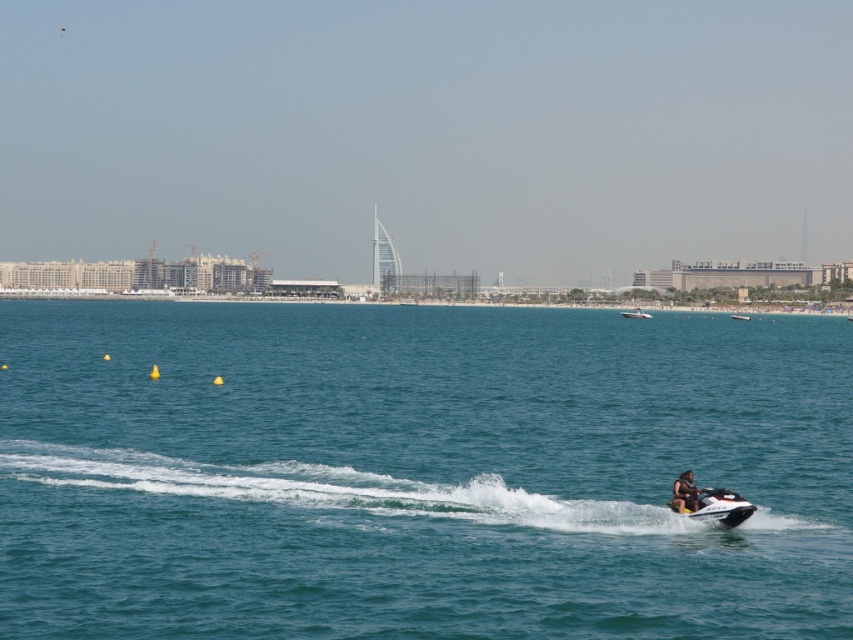
Question: Which object is closer to the camera taking this photo?

Choices:
 (A) metallic silver jet ski at center
 (B) dark blue fabric life jacket at lower right
 (C) white glossy boat at center
 (D) white glossy jet ski at lower right

Answer: (D)

Question: Considering the relative positions of clear blue water at center and dark blue fabric life jacket at lower right in the image provided, where is clear blue water at center located with respect to dark blue fabric life jacket at lower right?

Choices:
 (A) below
 (B) above

Answer: (B)

Question: Among these objects, which one is farthest from the camera?

Choices:
 (A) white glossy jet ski at lower right
 (B) metallic silver jet ski at center
 (C) dark blue fabric life jacket at lower right

Answer: (B)

Question: Is clear blue water at center above metallic silver jet ski at center?

Choices:
 (A) no
 (B) yes

Answer: (A)

Question: From the image, what is the correct spatial relationship of white glossy jet ski at lower right in relation to white glossy boat at center?

Choices:
 (A) right
 (B) left

Answer: (B)

Question: Estimate the real-world distances between objects in this image. Which object is farther from the white glossy boat at center?

Choices:
 (A) dark blue fabric life jacket at lower right
 (B) clear blue water at center
 (C) white glossy jet ski at lower right
 (D) metallic silver jet ski at center

Answer: (A)